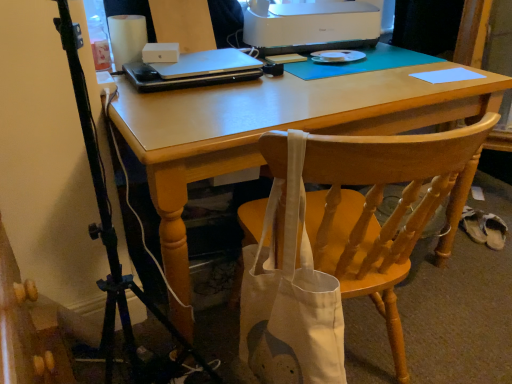
Where is `free space below light blue paper at upper right (from a real-world perspective)`? The width and height of the screenshot is (512, 384). free space below light blue paper at upper right (from a real-world perspective) is located at coordinates (448, 76).